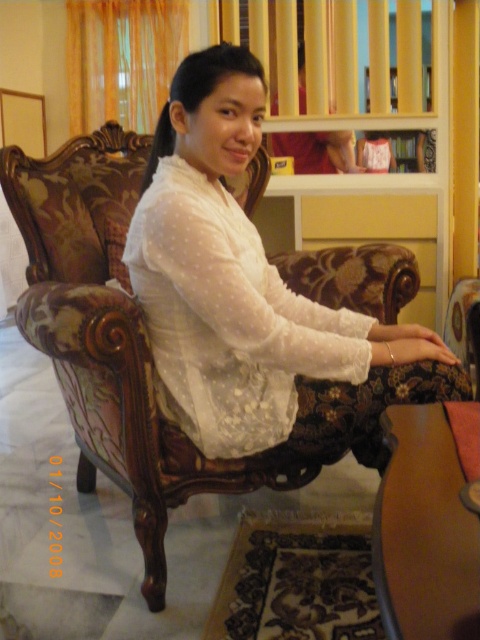
You are standing in the room and see two points marked in the image. The first point is at position point (216, 81) and the second point is at position point (368, 134). Which point is closer to you?

Point (216, 81) is in front of point (368, 134), so it is closer to you.

You are a fashion designer observing the image. You need to decide which clothing item, the white sheer blouse at center or the white sheer dress at center, would require more fabric to create. Based on the description provided, which one would you choose?

The white sheer blouse at center might be wider than the white sheer dress at center, so it would require more fabric to create.